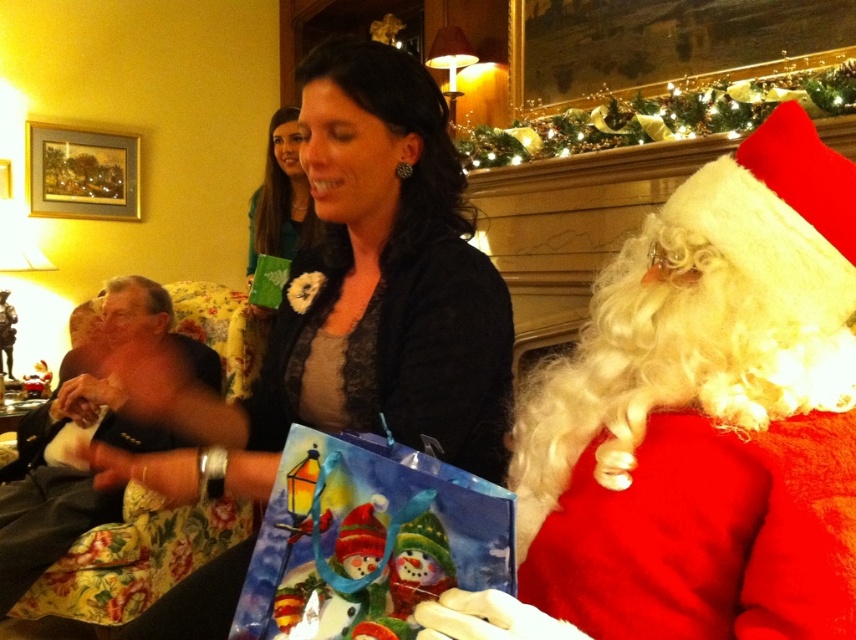
You are a photographer standing in the middle of the room. You want to take a photo of the red fluffy santa at right and the woman holding the gift bag. How far apart are the two subjects?

The red fluffy santa at right and the woman holding the gift bag are 24.16 inches apart.

You are a photographer standing in the middle of the room. You want to take a photo that includes both the red fluffy santa at right and the matte green fabric at upper center. Is there enough space between them to fit both in the frame?

The red fluffy santa at right and the matte green fabric at upper center are 2.27 meters apart from each other, so yes, there is enough space between them to fit both in the frame.